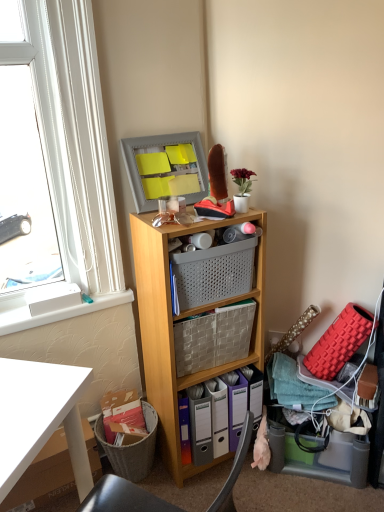
Question: Does white cardboard box at lower left have a smaller size compared to gray perforated basket at center, which appears as the first basket when viewed from the top?

Choices:
 (A) no
 (B) yes

Answer: (A)

Question: Is white cardboard box at lower left positioned beyond the bounds of gray perforated basket at center, which appears as the first basket when viewed from the top?

Choices:
 (A) yes
 (B) no

Answer: (A)

Question: Is white cardboard box at lower left at the left side of gray perforated basket at center, which appears as the first basket when viewed from the top?

Choices:
 (A) yes
 (B) no

Answer: (A)

Question: From the image's perspective, is white cardboard box at lower left beneath gray perforated basket at center, which appears as the first basket when viewed from the top?

Choices:
 (A) yes
 (B) no

Answer: (A)

Question: Is white cardboard box at lower left in contact with gray perforated basket at center, which appears as the first basket when viewed from the top?

Choices:
 (A) yes
 (B) no

Answer: (B)

Question: Is white cardboard box at lower left oriented towards gray perforated basket at center, which is counted as the 2th basket, starting from the bottom?

Choices:
 (A) yes
 (B) no

Answer: (B)

Question: Is woven fabric basket at center, positioned as the 1th basket in bottom-to-top order, oriented away from translucent plastic storage box at lower right?

Choices:
 (A) yes
 (B) no

Answer: (B)

Question: Could you tell me if woven fabric basket at center, positioned as the 1th basket in bottom-to-top order, is turned towards translucent plastic storage box at lower right?

Choices:
 (A) yes
 (B) no

Answer: (B)

Question: Is woven fabric basket at center, positioned as the 1th basket in bottom-to-top order, surrounding translucent plastic storage box at lower right?

Choices:
 (A) no
 (B) yes

Answer: (A)

Question: From the image's perspective, does woven fabric basket at center, positioned as the 1th basket in bottom-to-top order, appear higher than translucent plastic storage box at lower right?

Choices:
 (A) no
 (B) yes

Answer: (B)

Question: Can you confirm if woven fabric basket at center, positioned as the second basket in top-to-bottom order, is smaller than translucent plastic storage box at lower right?

Choices:
 (A) no
 (B) yes

Answer: (B)

Question: Can you confirm if woven fabric basket at center, positioned as the second basket in top-to-bottom order, is positioned to the right of translucent plastic storage box at lower right?

Choices:
 (A) yes
 (B) no

Answer: (B)

Question: Are white plastic window sill at upper left and gray perforated basket at center, which appears as the first basket when viewed from the top, making contact?

Choices:
 (A) yes
 (B) no

Answer: (B)